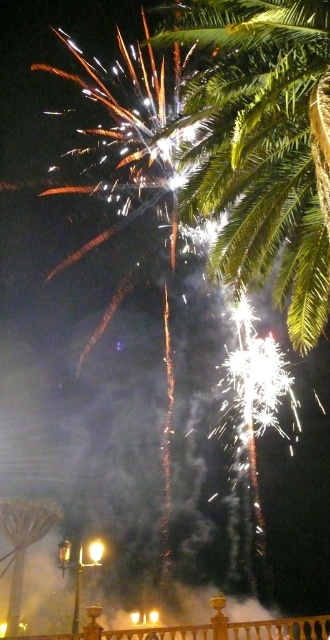
Question: Which point is farther from the camera taking this photo?

Choices:
 (A) (290, 106)
 (B) (63, 556)

Answer: (B)

Question: Is the position of green leafy palm at upper right more distant than that of metallic streetlight at lower left?

Choices:
 (A) no
 (B) yes

Answer: (A)

Question: Does metallic streetlight at lower left have a greater width compared to metallic yellow light at center?

Choices:
 (A) no
 (B) yes

Answer: (B)

Question: Which point is closer to the camera taking this photo?

Choices:
 (A) (252, 625)
 (B) (311, 10)

Answer: (B)

Question: Does wooden railing at lower center have a greater width compared to metallic streetlight at lower center?

Choices:
 (A) yes
 (B) no

Answer: (A)

Question: Which object is the farthest from the metallic yellow light at center?

Choices:
 (A) metallic streetlight at lower left
 (B) green leafy palm at upper right

Answer: (B)